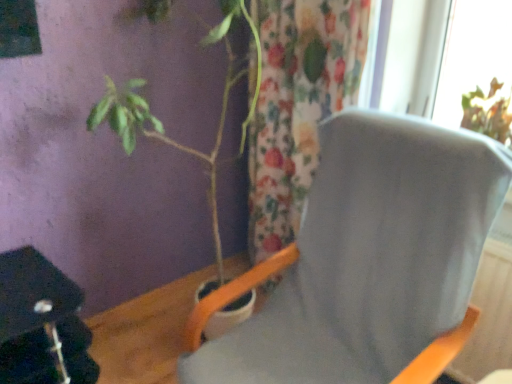
Question: Is the position of gray fabric chair at center less distant than that of floral fabric curtain at center?

Choices:
 (A) no
 (B) yes

Answer: (B)

Question: Can you confirm if gray fabric chair at center is positioned to the right of floral fabric curtain at center?

Choices:
 (A) yes
 (B) no

Answer: (B)

Question: Is gray fabric chair at center further to the viewer compared to floral fabric curtain at center?

Choices:
 (A) yes
 (B) no

Answer: (B)

Question: Does gray fabric chair at center turn towards floral fabric curtain at center?

Choices:
 (A) no
 (B) yes

Answer: (A)

Question: Can you confirm if gray fabric chair at center is wider than floral fabric curtain at center?

Choices:
 (A) yes
 (B) no

Answer: (A)

Question: Is floral fabric curtain at center inside gray fabric chair at center?

Choices:
 (A) yes
 (B) no

Answer: (B)

Question: Does floral fabric curtain at center turn towards gray fabric chair at center?

Choices:
 (A) no
 (B) yes

Answer: (A)

Question: Does floral fabric curtain at center have a greater height compared to gray fabric chair at center?

Choices:
 (A) no
 (B) yes

Answer: (B)

Question: Does floral fabric curtain at center lie behind gray fabric chair at center?

Choices:
 (A) yes
 (B) no

Answer: (A)

Question: Does floral fabric curtain at center have a smaller size compared to gray fabric chair at center?

Choices:
 (A) yes
 (B) no

Answer: (A)

Question: From the image's perspective, does floral fabric curtain at center appear lower than gray fabric chair at center?

Choices:
 (A) yes
 (B) no

Answer: (B)

Question: Can you confirm if floral fabric curtain at center is positioned to the right of gray fabric chair at center?

Choices:
 (A) yes
 (B) no

Answer: (A)

Question: Considering the relative positions of green matte plant at left and gray fabric chair at center in the image provided, is green matte plant at left to the right of gray fabric chair at center from the viewer's perspective?

Choices:
 (A) yes
 (B) no

Answer: (B)